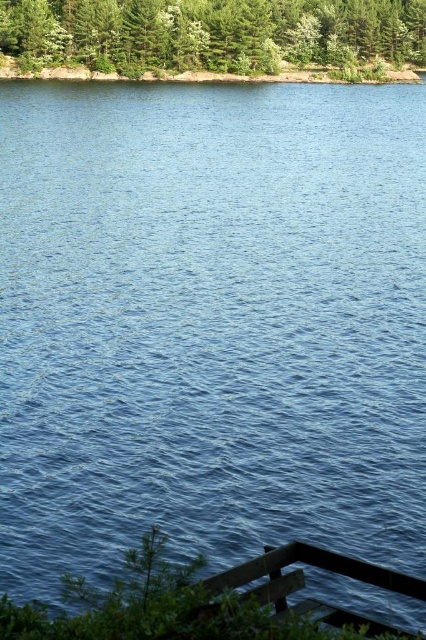
Who is shorter, green leafy trees at upper center or wooden dock at lower right?

With less height is wooden dock at lower right.

Does green leafy trees at upper center lie in front of wooden dock at lower right?

No, green leafy trees at upper center is behind wooden dock at lower right.

Is point (184, 68) farther from viewer compared to point (316, 561)?

That is True.

The height and width of the screenshot is (640, 426). I want to click on green leafy trees at upper center, so click(x=210, y=32).